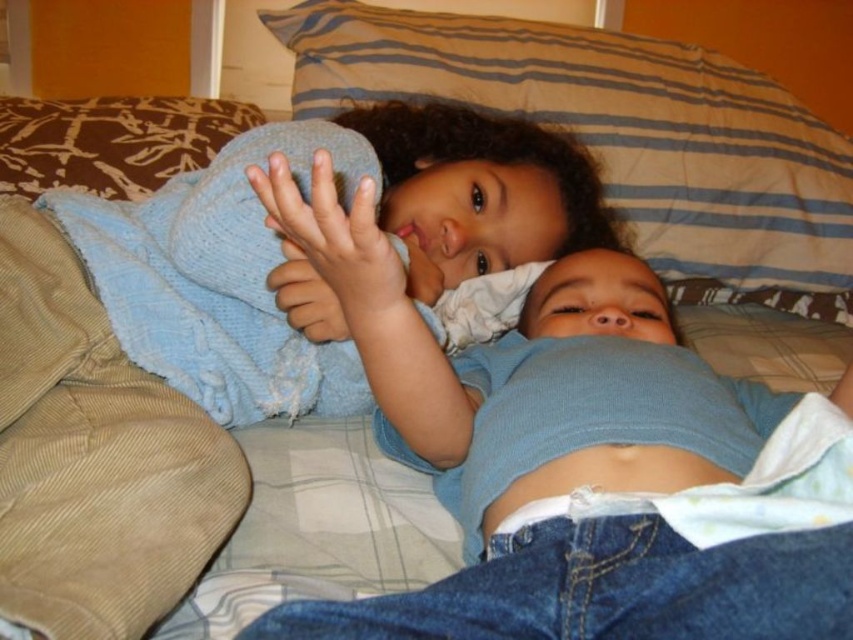
Question: Is blue cotton shirt at center bigger than brown textured pillow at upper left?

Choices:
 (A) yes
 (B) no

Answer: (A)

Question: Which object appears farthest from the camera in this image?

Choices:
 (A) striped fabric pillow at upper center
 (B) brown textured pillow at upper left
 (C) blue cotton shirt at center

Answer: (A)

Question: Does blue cotton shirt at center have a smaller size compared to striped fabric pillow at upper center?

Choices:
 (A) yes
 (B) no

Answer: (A)

Question: Is blue cotton shirt at center positioned behind striped fabric pillow at upper center?

Choices:
 (A) yes
 (B) no

Answer: (B)

Question: Which point is closer to the camera?

Choices:
 (A) brown textured pillow at upper left
 (B) striped fabric pillow at upper center

Answer: (A)

Question: Which point is closer to the camera taking this photo?

Choices:
 (A) (450, 88)
 (B) (387, 342)
 (C) (6, 161)

Answer: (B)